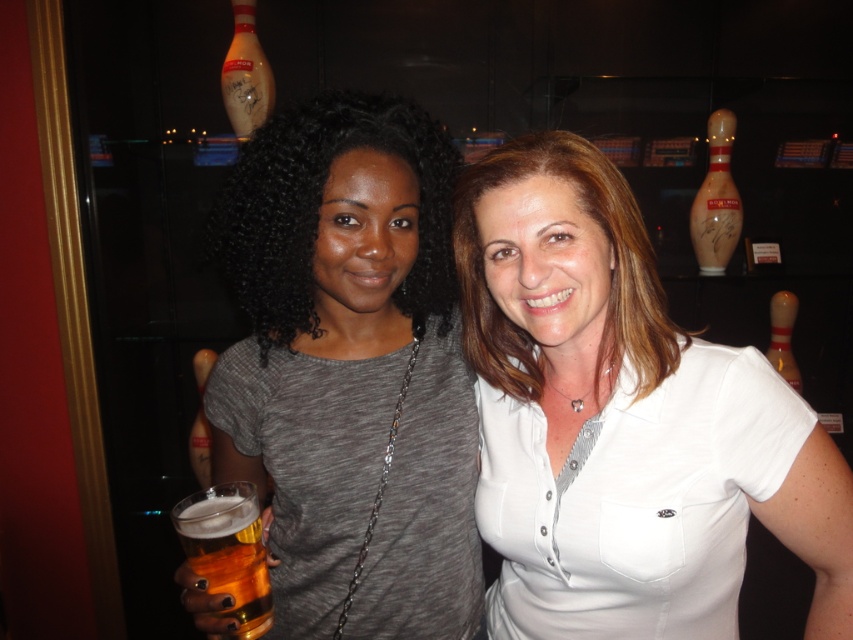
You are standing in a bowling alley and want to place a 24 inch long trophy on a shelf. The shelf is located at point (689, 582). Can the trophy fit on the shelf if the shelf is 28 inches long?

The shelf at point (689, 582) is 28 inches long. The trophy is 24 inches long, so it will fit as it is shorter than the shelf length.

You are a photographer trying to capture a clear shot of the white glossy shirt at center and the golden amber liquid at lower left. Since you want both subjects to be in focus, which one should you focus on first to ensure the other remains sharp?

You should focus on the white glossy shirt at center first because it is closer to the camera than the golden amber liquid at lower left. By focusing on the closer subject, the farther one will still be within the depth of field, ensuring both are sharp.